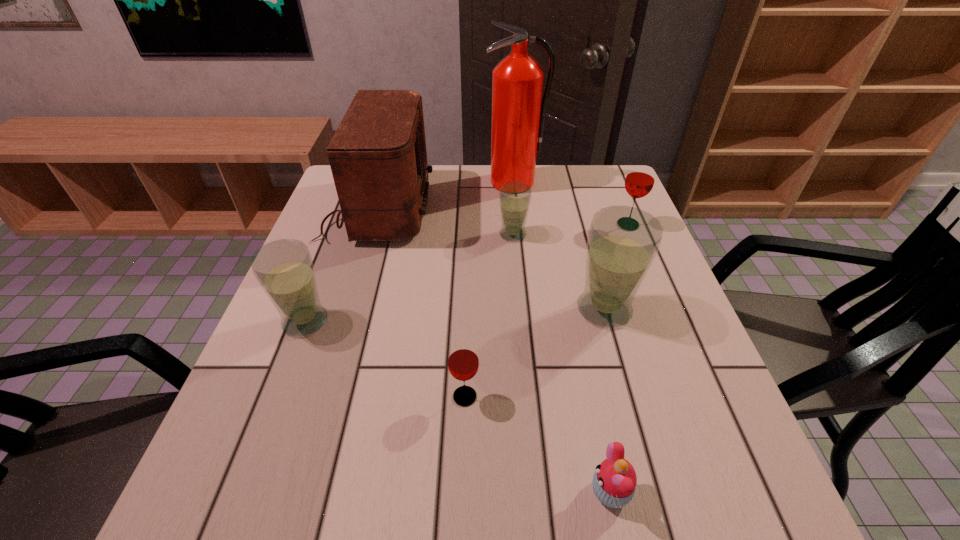
Locate an element on the screen. The image size is (960, 540). object that is at the far left corner is located at coordinates (378, 158).

Identify the location of vacant space at the far edge of the desktop. The image size is (960, 540). (x=444, y=201).

Where is `free space at the near edge of the desktop`? The height and width of the screenshot is (540, 960). free space at the near edge of the desktop is located at coordinates (517, 528).

In the image, there is a desktop. Where is `vacant space at the left edge`? The image size is (960, 540). vacant space at the left edge is located at coordinates (331, 223).

The width and height of the screenshot is (960, 540). In the image, there is a desktop. In order to click on vacant space at the right edge in this screenshot , I will do `click(636, 351)`.

In the image, there is a desktop. In order to click on vacant space at the near left corner in this screenshot , I will do `click(227, 496)`.

This screenshot has height=540, width=960. In order to click on free space between the right red glass and the tallest object in this screenshot , I will do `click(571, 204)`.

This screenshot has height=540, width=960. Find the location of `unoccupied area between the tallest object and the farther red glass`. unoccupied area between the tallest object and the farther red glass is located at coordinates (571, 204).

Identify the location of vacant area that lies between the leftmost glass and the bigger red glass. (467, 273).

Identify the location of blank region between the third tallest object and the shortest object. (607, 401).